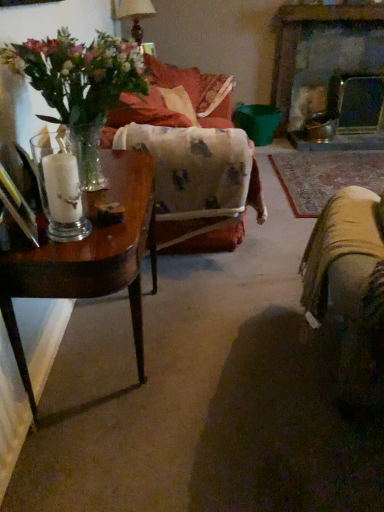
You are a GUI agent. You are given a task and a screenshot of the screen. Output one action in this format:
    pyautogui.click(x=<x>, y=<y>)
    Task: Click on the matte white lampshade at upper center
    
    Given the screenshot: What is the action you would take?
    pyautogui.click(x=135, y=15)

Measure the distance between point (209, 122) and camera.

The distance of point (209, 122) from camera is 7.89 feet.

Where is `wooden table at left`? The width and height of the screenshot is (384, 512). wooden table at left is located at coordinates (86, 256).

This screenshot has height=512, width=384. What do you see at coordinates (60, 185) in the screenshot?
I see `clear glass candle at left` at bounding box center [60, 185].

Image resolution: width=384 pixels, height=512 pixels. What do you see at coordinates (299, 36) in the screenshot?
I see `smooth stone fireplace at upper right` at bounding box center [299, 36].

This screenshot has width=384, height=512. Find the location of `matte white lampshade at upper center`. matte white lampshade at upper center is located at coordinates (135, 15).

How much distance is there between clear glass candle at left and wooden table at left?

clear glass candle at left is 7.39 inches from wooden table at left.

Between point (51, 137) and point (37, 287), which one is positioned behind?

The point (51, 137) is behind.

From the image's perspective, is clear glass candle at left above or below wooden table at left?

Based on their image positions, clear glass candle at left is located above wooden table at left.

From the picture: Between clear glass candle at left and wooden table at left, which one has smaller size?

Smaller between the two is clear glass candle at left.

Does smooth stone fireplace at upper right come in front of matte white lampshade at upper center?

No, smooth stone fireplace at upper right is further to the viewer.

From the image's perspective, is smooth stone fireplace at upper right above or below matte white lampshade at upper center?

Clearly, from the image's perspective, smooth stone fireplace at upper right is below matte white lampshade at upper center.

Considering the relative positions of smooth stone fireplace at upper right and matte white lampshade at upper center in the image provided, is smooth stone fireplace at upper right to the left of matte white lampshade at upper center from the viewer's perspective?

Incorrect, smooth stone fireplace at upper right is not on the left side of matte white lampshade at upper center.

Would you say matte white lampshade at upper center is part of smooth stone fireplace at upper right's contents?

No, matte white lampshade at upper center is not inside smooth stone fireplace at upper right.

This screenshot has width=384, height=512. Find the location of `houseplant that appears below the matte white lampshade at upper center (from the image's perspective)`. houseplant that appears below the matte white lampshade at upper center (from the image's perspective) is located at coordinates point(78,73).

Is matte white lampshade at upper center facing towards translucent glass vase at left?

No, matte white lampshade at upper center is not oriented towards translucent glass vase at left.

Is point (147, 16) in front of point (21, 61)?

That is False.

How distant is matte white lampshade at upper center from translucent glass vase at left?

matte white lampshade at upper center and translucent glass vase at left are 6.58 feet apart from each other.

Which of these two, clear glass candle at left or velvet orange couch at center, the 2th couch viewed from the front, stands shorter?

With less height is clear glass candle at left.

Is clear glass candle at left aimed at velvet orange couch at center, the 2th couch viewed from the front?

No, clear glass candle at left is not oriented towards velvet orange couch at center, the 2th couch viewed from the front.

Is clear glass candle at left wider than velvet orange couch at center, the 2th couch viewed from the front?

No, clear glass candle at left is not wider than velvet orange couch at center, the 2th couch viewed from the front.

Is point (68, 177) closer to camera compared to point (154, 104)?

Yes, it is in front of point (154, 104).

From a real-world perspective, is matte white lampshade at upper center physically above smooth stone fireplace at upper right?

Yes.

Would you say matte white lampshade at upper center contains smooth stone fireplace at upper right?

No.

Could you tell me if matte white lampshade at upper center is turned towards smooth stone fireplace at upper right?

Yes, matte white lampshade at upper center is turned towards smooth stone fireplace at upper right.

I want to click on lamp above the smooth stone fireplace at upper right (from the image's perspective), so click(135, 15).

Considering the relative sizes of wooden table at left and matte white lampshade at upper center in the image provided, is wooden table at left bigger than matte white lampshade at upper center?

Yes, wooden table at left is bigger than matte white lampshade at upper center.

Are wooden table at left and matte white lampshade at upper center beside each other?

wooden table at left and matte white lampshade at upper center are not in contact.

What's the angular difference between wooden table at left and matte white lampshade at upper center's facing directions?

The facing directions of wooden table at left and matte white lampshade at upper center are 0.00138 degrees apart.

From a real-world perspective, is wooden table at left under matte white lampshade at upper center?

Yes, from a real-world perspective, wooden table at left is below matte white lampshade at upper center.

Which of these two, clear glass candle at left or matte white lampshade at upper center, is wider?

matte white lampshade at upper center.

From the image's perspective, who appears lower, clear glass candle at left or matte white lampshade at upper center?

clear glass candle at left appears lower in the image.

The width and height of the screenshot is (384, 512). I want to click on table behind the clear glass candle at left, so click(86, 256).

Identify the location of lamp above the smooth stone fireplace at upper right (from the image's perspective). 135,15.

Based on their spatial positions, is smooth stone fireplace at upper right or velvet orange couch at center, which is the 1th couch in back-to-front order, further from clear glass candle at left?

smooth stone fireplace at upper right lies further to clear glass candle at left than the other object.

Estimate the real-world distances between objects in this image. Which object is closer to velvet orange couch at center, which is the 1th couch in back-to-front order, velvet floral couch at center, marked as the second couch in a back-to-front arrangement, or translucent glass vase at left?

velvet floral couch at center, marked as the second couch in a back-to-front arrangement.

Looking at the image, which one is located closer to wooden table at left, clear glass candle at left or velvet orange couch at center, the 2th couch viewed from the front?

clear glass candle at left lies closer to wooden table at left than the other object.

Which object lies further to the anchor point velvet orange couch at center, the 2th couch viewed from the front, translucent glass vase at left or clear glass candle at left?

clear glass candle at left.

When comparing their distances from matte white lampshade at upper center, does smooth stone fireplace at upper right or velvet orange couch at center, which is the 1th couch in back-to-front order, seem closer?

velvet orange couch at center, which is the 1th couch in back-to-front order, lies closer to matte white lampshade at upper center than the other object.

From the picture: When comparing their distances from clear glass candle at left, does wooden table at left or translucent glass vase at left seem closer?

wooden table at left is closer to clear glass candle at left.

Considering their positions, is velvet orange couch at center, which is the 1th couch in back-to-front order, positioned further to wooden table at left than clear glass candle at left?

Based on the image, velvet orange couch at center, which is the 1th couch in back-to-front order, appears to be further to wooden table at left.

Based on their spatial positions, is smooth stone fireplace at upper right or matte white lampshade at upper center further from wooden table at left?

smooth stone fireplace at upper right is positioned further to the anchor wooden table at left.

You are a GUI agent. You are given a task and a screenshot of the screen. Output one action in this format:
    pyautogui.click(x=<x>, y=<y>)
    Task: Click on the table between translucent glass vase at left and matte white lampshade at upper center from front to back
    This screenshot has width=384, height=512.
    Given the screenshot: What is the action you would take?
    pyautogui.click(x=86, y=256)

Identify the location of candle holder between translucent glass vase at left and wooden table at left in the vertical direction. The height and width of the screenshot is (512, 384). (60, 185).

Identify the location of couch positioned between velvet floral couch at center, marked as the second couch in a back-to-front arrangement, and smooth stone fireplace at upper right from near to far. This screenshot has width=384, height=512. (166, 106).

Where is `couch positioned between velvet floral couch at center, the 1th couch viewed from the front, and matte white lampshade at upper center from near to far`? The height and width of the screenshot is (512, 384). couch positioned between velvet floral couch at center, the 1th couch viewed from the front, and matte white lampshade at upper center from near to far is located at coordinates click(x=166, y=106).